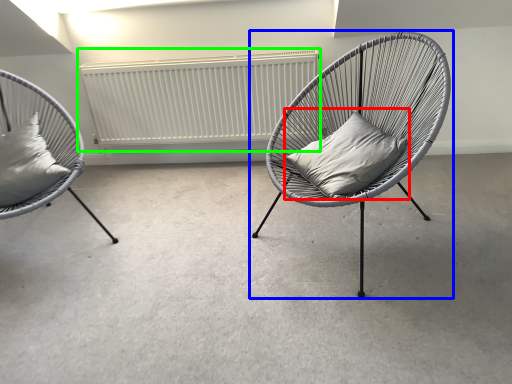
Question: Considering the real-world distances, which object is closest to pillow (highlighted by a red box)? chair (highlighted by a blue box) or radiator (highlighted by a green box).

Choices:
 (A) chair
 (B) radiator

Answer: (A)